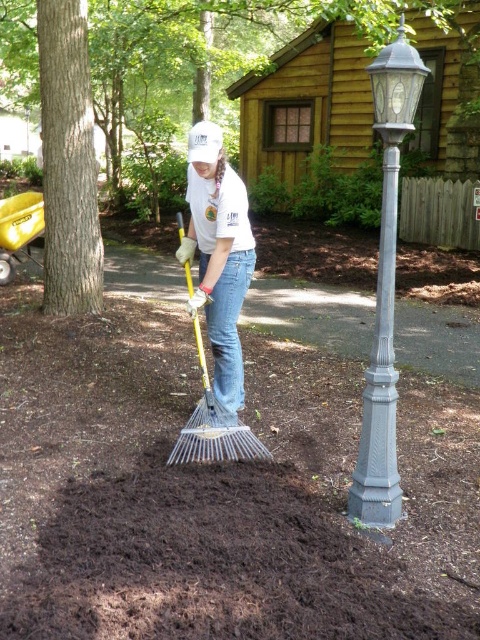
Between point (384, 172) and point (392, 312), which one is positioned behind?

Point (392, 312)

Is gray cast iron lamp post at right shorter than gray cast iron pole at right?

Correct, gray cast iron lamp post at right is not as tall as gray cast iron pole at right.

Who is more distant from viewer, (x=372, y=369) or (x=382, y=388)?

The point (x=372, y=369) is more distant.

At what (x,y) coordinates should I click in order to perform the action: click on gray cast iron lamp post at right. Please return your answer as a coordinate pair (x, y). The width and height of the screenshot is (480, 640). Looking at the image, I should click on (384, 291).

Between point (193, 141) and point (350, 508), which one is positioned behind?

Point (193, 141)

Between point (219, 305) and point (384, 337), which one is positioned in front?

Point (384, 337) is more forward.

The width and height of the screenshot is (480, 640). I want to click on white matte t-shirt at center, so click(218, 256).

Can you confirm if gray cast iron lamp post at right is wider than white matte t-shirt at center?

No.

Between gray cast iron lamp post at right and white matte t-shirt at center, which one is positioned lower?

gray cast iron lamp post at right is below.

What do you see at coordinates (384, 291) in the screenshot? I see `gray cast iron lamp post at right` at bounding box center [384, 291].

Where is `gray cast iron lamp post at right`? gray cast iron lamp post at right is located at coordinates (384, 291).